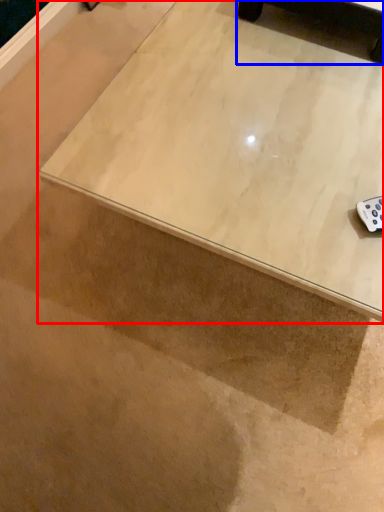
Question: Which point is further to the camera, table (highlighted by a red box) or furniture (highlighted by a blue box)?

Choices:
 (A) table
 (B) furniture

Answer: (B)